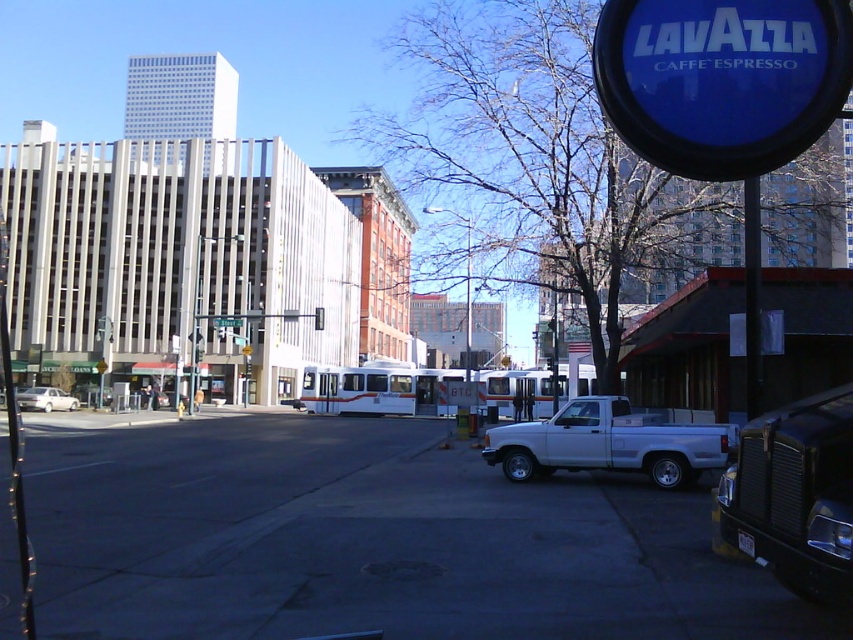
You are a delivery person trying to park a new vehicle that is the same size as the white matte truck at lower right. The parking spot is on the gray concrete pavement at center. Can the vehicle fit in the parking spot?

The gray concrete pavement at center is bigger than white matte truck at lower right, so yes, the vehicle can fit in the parking spot since the pavement is larger than the truck.

You are a pedestrian standing at the edge of the gray concrete pavement at center and want to cross the street to reach the white matte truck at lower right. Which direction should you walk to get to the truck?

You should walk to the right because the gray concrete pavement at center is positioned on the left side of white matte truck at lower right, so moving right along the pavement will lead you towards the truck.